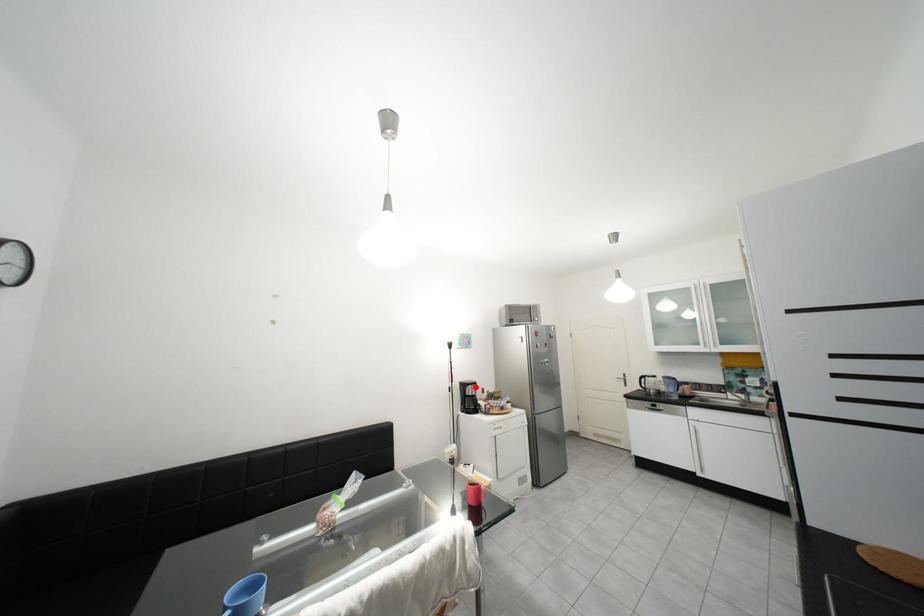
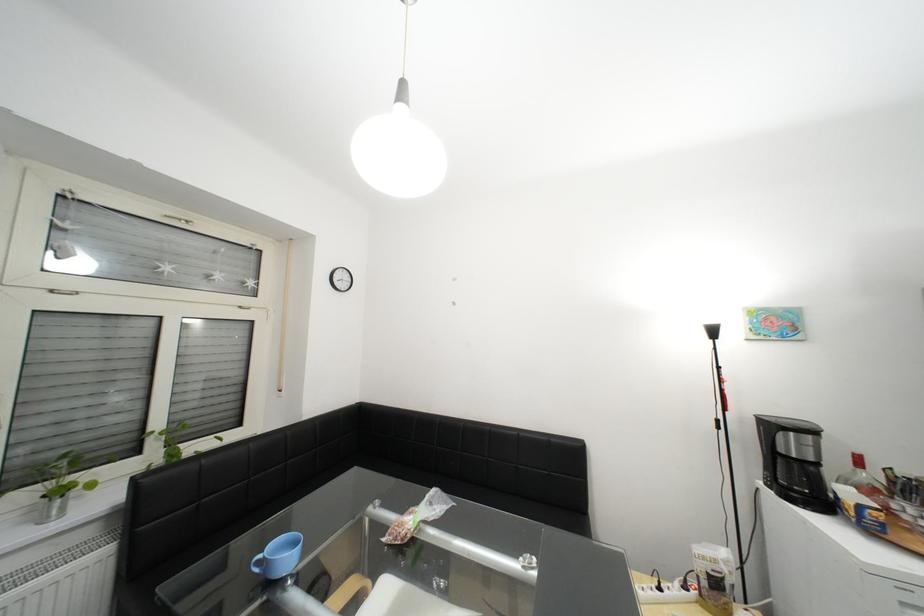
Where in the second image is the point corresponding to the highlighted location from the first image?

(782, 428)